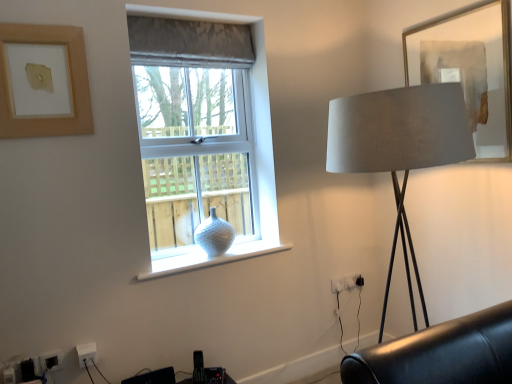
Locate an element on the screen. gray textured fabric curtain at upper center is located at coordinates (189, 43).

The height and width of the screenshot is (384, 512). Describe the element at coordinates (211, 258) in the screenshot. I see `white glossy vase at center` at that location.

This screenshot has height=384, width=512. What do you see at coordinates (253, 147) in the screenshot? I see `white textured vase at center` at bounding box center [253, 147].

Identify the location of gray textured fabric curtain at upper center. (189, 43).

Is white glossy vase at center not within gray textured fabric curtain at upper center?

Yes, white glossy vase at center is not within gray textured fabric curtain at upper center.

Considering the relative sizes of white glossy vase at center and gray textured fabric curtain at upper center in the image provided, is white glossy vase at center bigger than gray textured fabric curtain at upper center?

No.

Which is behind, point (159, 262) or point (234, 67)?

The point (234, 67) is behind.

From a real-world perspective, is wooden picture frame at upper left, arranged as the second picture frame when viewed from the right, positioned under white glossy vase at center based on gravity?

Actually, wooden picture frame at upper left, arranged as the second picture frame when viewed from the right, is physically above white glossy vase at center in the real world.

Consider the image. Considering the relative sizes of wooden picture frame at upper left, arranged as the second picture frame when viewed from the right, and white glossy vase at center in the image provided, is wooden picture frame at upper left, arranged as the second picture frame when viewed from the right, thinner than white glossy vase at center?

Yes, wooden picture frame at upper left, arranged as the second picture frame when viewed from the right, is thinner than white glossy vase at center.

Image resolution: width=512 pixels, height=384 pixels. Identify the location of picture frame that is the 2nd one above the white glossy vase at center (from a real-world perspective). (42, 81).

Which is more to the right, wooden picture frame at upper left, the 2th picture frame viewed from the back, or white glossy vase at center?

Positioned to the right is white glossy vase at center.

Can you confirm if gray textured fabric curtain at upper center is taller than white glossy vase at center?

Indeed, gray textured fabric curtain at upper center has a greater height compared to white glossy vase at center.

Would you say gray textured fabric curtain at upper center is inside or outside white glossy vase at center?

gray textured fabric curtain at upper center lies outside white glossy vase at center.

Does gray textured fabric curtain at upper center have a smaller size compared to white glossy vase at center?

Actually, gray textured fabric curtain at upper center might be larger than white glossy vase at center.

Visually, is gray textured fabric curtain at upper center positioned to the left or to the right of white glossy vase at center?

Clearly, gray textured fabric curtain at upper center is on the left of white glossy vase at center in the image.

Is point (333, 285) closer to viewer compared to point (162, 260)?

No, (333, 285) is behind (162, 260).

Considering the sizes of white plastic electric outlet at lower right, the 2th electric outlet in the bottom-to-top sequence, and white glossy vase at center in the image, is white plastic electric outlet at lower right, the 2th electric outlet in the bottom-to-top sequence, taller or shorter than white glossy vase at center?

In the image, white plastic electric outlet at lower right, the 2th electric outlet in the bottom-to-top sequence, appears to be taller than white glossy vase at center.

Between white plastic electric outlet at lower right, the 2th electric outlet from the right, and white glossy vase at center, which one has smaller size?

Smaller between the two is white plastic electric outlet at lower right, the 2th electric outlet from the right.

You are a GUI agent. You are given a task and a screenshot of the screen. Output one action in this format:
    pyautogui.click(x=<x>, y=<y>)
    Task: Click on the window sill that appears in front of the white plastic electric outlet at lower right, acting as the 2th electric outlet starting from the left
    
    Given the screenshot: What is the action you would take?
    pyautogui.click(x=211, y=258)

Which is further, (362, 282) or (237, 245)?

The point (362, 282) is farther.

Which of these two, white plastic electric outlet at lower right, positioned as the first electric outlet in top-to-bottom order, or white glossy vase at center, stands shorter?

Standing shorter between the two is white glossy vase at center.

Is white plastic electric outlet at lower right, placed as the third electric outlet when sorted from left to right, surrounding white glossy vase at center?

No.

Is white plastic electric outlet at lower right, positioned as the first electric outlet in top-to-bottom order, bigger or smaller than white glossy vase at center?

Considering their sizes, white plastic electric outlet at lower right, positioned as the first electric outlet in top-to-bottom order, takes up less space than white glossy vase at center.

Can you tell me how much white glossy vase at window and satin beige lampshade at right differ in facing direction?

The angle between the facing direction of white glossy vase at window and the facing direction of satin beige lampshade at right is 90.1 degrees.

Can you confirm if white glossy vase at window is shorter than satin beige lampshade at right?

Indeed, white glossy vase at window has a lesser height compared to satin beige lampshade at right.

Is white glossy vase at window in contact with satin beige lampshade at right?

No, white glossy vase at window is not next to satin beige lampshade at right.

Which is more to the left, white glossy vase at window or satin beige lampshade at right?

white glossy vase at window.

Is matte silver picture frame at upper right, marked as the first picture frame in a right-to-left arrangement, next to white plastic electric outlet at lower right, positioned as the first electric outlet in right-to-left order, and touching it?

No, matte silver picture frame at upper right, marked as the first picture frame in a right-to-left arrangement, is not making contact with white plastic electric outlet at lower right, positioned as the first electric outlet in right-to-left order.

Is white plastic electric outlet at lower right, which is the 3th electric outlet from front to back, surrounded by matte silver picture frame at upper right, the 1th picture frame when ordered from back to front?

No, white plastic electric outlet at lower right, which is the 3th electric outlet from front to back, is not surrounded by matte silver picture frame at upper right, the 1th picture frame when ordered from back to front.

Starting from the matte silver picture frame at upper right, the second picture frame when ordered from left to right, which electric outlet is the 3rd one behind? Please provide its 2D coordinates.

[(353, 281)]

Considering the sizes of objects matte silver picture frame at upper right, marked as the first picture frame in a right-to-left arrangement, and white plastic electric outlet at lower right, arranged as the 1th electric outlet when viewed from the back, in the image provided, who is smaller, matte silver picture frame at upper right, marked as the first picture frame in a right-to-left arrangement, or white plastic electric outlet at lower right, arranged as the 1th electric outlet when viewed from the back,?

white plastic electric outlet at lower right, arranged as the 1th electric outlet when viewed from the back, is smaller.

This screenshot has height=384, width=512. Identify the location of window sill below the gray textured fabric curtain at upper center (from the image's perspective). (211, 258).

The width and height of the screenshot is (512, 384). In order to click on window sill below the wooden picture frame at upper left, which appears as the first picture frame when viewed from the left (from a real-world perspective) in this screenshot , I will do `click(211, 258)`.

When comparing their distances from white glossy vase at center, does white plastic electric outlet at lower right, placed as the third electric outlet when sorted from left to right, or white plastic electric outlet at lower left, the 3th electric outlet when ordered from top to bottom, seem further?

The object further to white glossy vase at center is white plastic electric outlet at lower right, placed as the third electric outlet when sorted from left to right.

Based on their spatial positions, is white plastic electric outlet at lower left, the first electric outlet from the left, or white plastic electric outlet at lower right, positioned as the first electric outlet in top-to-bottom order, closer to white plastic electric outlet at lower right, placed as the second electric outlet when sorted from top to bottom?

Based on the image, white plastic electric outlet at lower right, positioned as the first electric outlet in top-to-bottom order, appears to be nearer to white plastic electric outlet at lower right, placed as the second electric outlet when sorted from top to bottom.

Looking at the image, which one is located closer to white textured vase at center, gray textured fabric curtain at upper center or satin beige lampshade at right?

gray textured fabric curtain at upper center lies closer to white textured vase at center than the other object.

Considering their positions, is white textured vase at center positioned closer to white plastic electric outlet at lower right, which is the 3th electric outlet from front to back, than matte silver picture frame at upper right, the 1th picture frame when ordered from back to front?

white textured vase at center lies closer to white plastic electric outlet at lower right, which is the 3th electric outlet from front to back, than the other object.

In the scene shown: When comparing their distances from white plastic electric outlet at lower right, the 2th electric outlet positioned from the front, does white plastic electric outlet at lower right, which is the 3th electric outlet from front to back, or matte silver picture frame at upper right, which is the second picture frame in front-to-back order, seem closer?

white plastic electric outlet at lower right, which is the 3th electric outlet from front to back, lies closer to white plastic electric outlet at lower right, the 2th electric outlet positioned from the front, than the other object.

From the image, which object appears to be farther from satin beige lampshade at right, white plastic electric outlet at lower right, the 2th electric outlet in the bottom-to-top sequence, or white glossy vase at center?

The object further to satin beige lampshade at right is white plastic electric outlet at lower right, the 2th electric outlet in the bottom-to-top sequence.

Considering their positions, is satin beige lampshade at right positioned further to wooden picture frame at upper left, acting as the first picture frame starting from the front, than white plastic electric outlet at lower right, placed as the second electric outlet when sorted from top to bottom?

The object further to wooden picture frame at upper left, acting as the first picture frame starting from the front, is white plastic electric outlet at lower right, placed as the second electric outlet when sorted from top to bottom.

Which object lies nearer to the anchor point matte silver picture frame at upper right, the 1th picture frame when ordered from back to front, white glossy vase at center or white plastic electric outlet at lower left, the 3th electric outlet when ordered from top to bottom?

The object closer to matte silver picture frame at upper right, the 1th picture frame when ordered from back to front, is white glossy vase at center.

Where is `glass vase between gray textured fabric curtain at upper center and white plastic electric outlet at lower right, the 2th electric outlet from the right, in the up-down direction`? The image size is (512, 384). glass vase between gray textured fabric curtain at upper center and white plastic electric outlet at lower right, the 2th electric outlet from the right, in the up-down direction is located at coordinates (214, 235).

Identify the location of window sill situated between wooden picture frame at upper left, which appears as the first picture frame when viewed from the left, and matte silver picture frame at upper right, which is the second picture frame in front-to-back order, from left to right. (211, 258).

Image resolution: width=512 pixels, height=384 pixels. I want to click on glass vase located between white textured vase at center and matte silver picture frame at upper right, marked as the first picture frame in a right-to-left arrangement, in the left-right direction, so click(x=214, y=235).

What are the coordinates of `glass vase between wooden picture frame at upper left, the 2th picture frame viewed from the back, and white plastic electric outlet at lower left, arranged as the 3th electric outlet when viewed from the right, from top to bottom` in the screenshot? It's located at (214, 235).